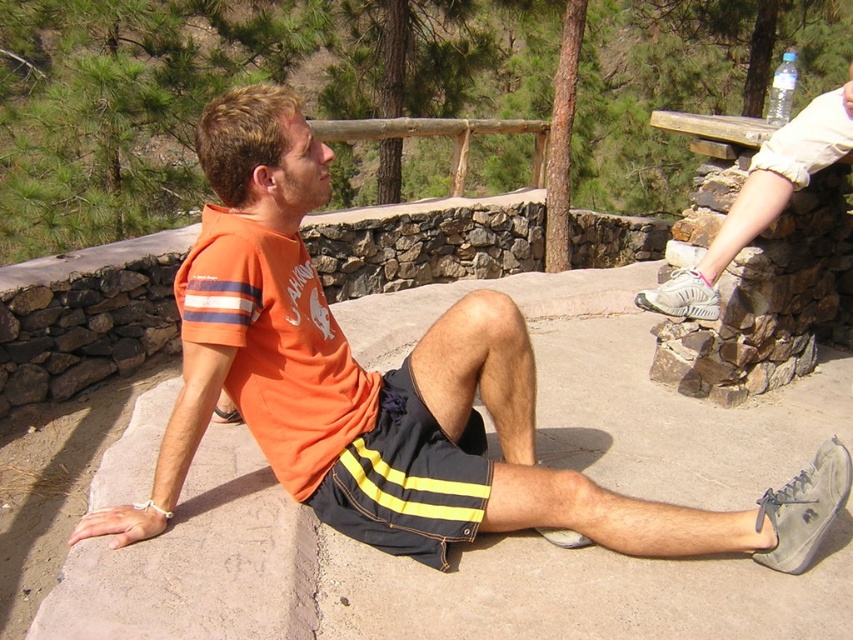
You are standing at the origin of a coordinate system placed at the bottom left corner of the image. You see an orange T shirt at center and a point at coordinates (393, 392). Is the point located on the orange T shirt at center?

Yes, the point at coordinates (393, 392) is located on the orange T shirt at center.

Where is the dark blue shorts with yellow stripes at center located in the image?

The dark blue shorts with yellow stripes at center is located at point (x=407, y=477) in the image.